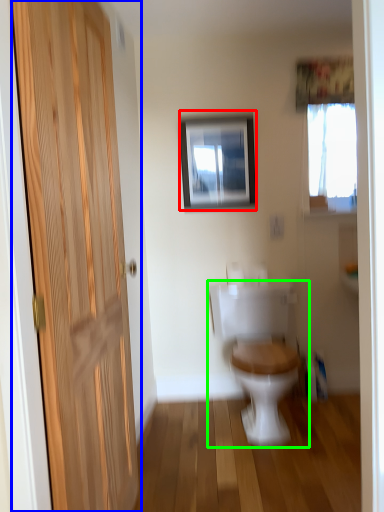
Question: Considering the real-world distances, which object is closest to picture frame (highlighted by a red box)? door (highlighted by a blue box) or toilet (highlighted by a green box).

Choices:
 (A) door
 (B) toilet

Answer: (B)